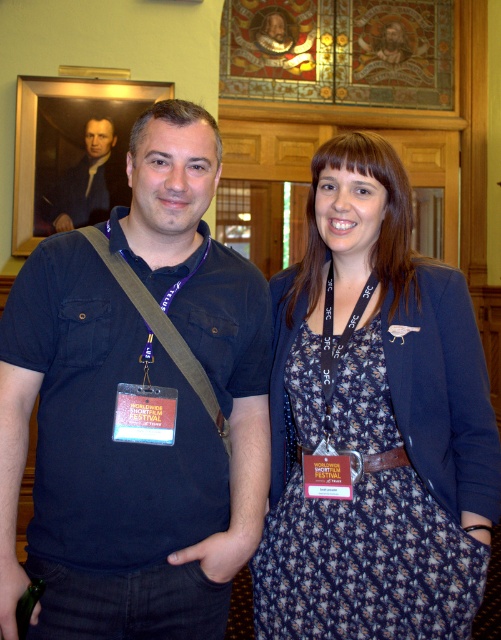
You are at a networking event and want to read the orange card at center without moving your head. Can you see it clearly because it is in front of or behind the smooth white face at upper left?

The orange card at center is behind the smooth white face at upper left, so you cannot see it clearly without moving your head.